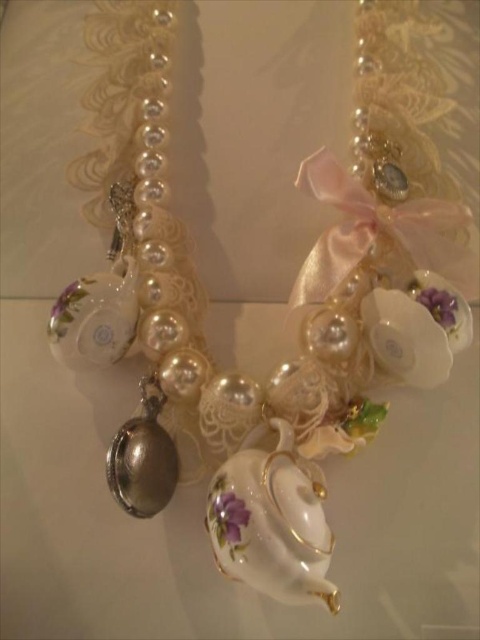
Does porcelain teapot at center have a greater width compared to purple glossy flower at center?

Yes.

Can you confirm if porcelain teapot at center is positioned to the right of purple glossy flower at center?

Indeed, porcelain teapot at center is positioned on the right side of purple glossy flower at center.

Does point (280, 445) come farther from viewer compared to point (222, 513)?

Yes.

Where is `porcelain teapot at center`? porcelain teapot at center is located at coordinates (273, 522).

This screenshot has width=480, height=640. In order to click on purple glossy flower at center in this screenshot , I will do `click(228, 516)`.

Where is `purple glossy flower at center`? This screenshot has height=640, width=480. purple glossy flower at center is located at coordinates (228, 516).

Where is `purple glossy flower at center`? The height and width of the screenshot is (640, 480). purple glossy flower at center is located at coordinates (228, 516).

Which is in front, point (235, 554) or point (421, 294)?

Point (235, 554) is in front.

Who is taller, porcelain teapot at center or purple porcelain flower at center?

Standing taller between the two is porcelain teapot at center.

Identify the location of porcelain teapot at center. point(273,522).